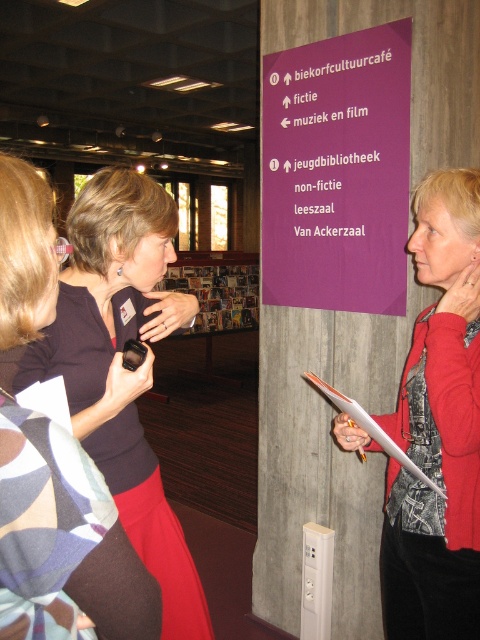
You are a visitor in the library and you see the matte black phone at center and the white paper clipboard at right. Which object is located lower in the scene?

The matte black phone at center is located below the white paper clipboard at right, so the matte black phone at center is lower in the scene.

You are standing in the library and see a red matte jacket at center and a matte black phone at center. Which item is located below the other?

The red matte jacket at center is positioned under the matte black phone at center, so the jacket is below the phone.